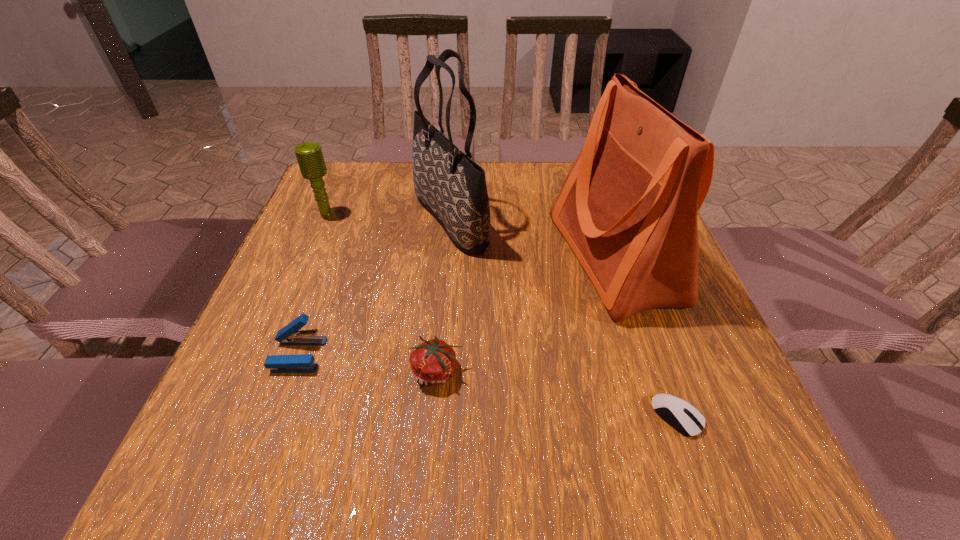
You are a GUI agent. You are given a task and a screenshot of the screen. Output one action in this format:
    pyautogui.click(x=<x>, y=<y>)
    Task: Click on the mouse present at the right edge
    
    Given the screenshot: What is the action you would take?
    pyautogui.click(x=685, y=418)

I want to click on object positioned at the far left corner, so click(309, 155).

The image size is (960, 540). What are the coordinates of `object that is at the far right corner` in the screenshot? It's located at (628, 207).

Where is `object that is at the near right corner`? object that is at the near right corner is located at coordinates (685, 418).

In the image, there is a desktop. At what (x,y) coordinates should I click in order to perform the action: click on vacant space at the far edge. Please return your answer as a coordinate pair (x, y). The height and width of the screenshot is (540, 960). Looking at the image, I should click on (547, 183).

The image size is (960, 540). I want to click on vacant space at the near edge, so pyautogui.click(x=571, y=457).

This screenshot has height=540, width=960. I want to click on free space at the left edge of the desktop, so click(x=252, y=345).

Find the location of a particular element. The height and width of the screenshot is (540, 960). vacant space at the right edge is located at coordinates (728, 395).

Identify the location of blank area at the far left corner. (329, 172).

The width and height of the screenshot is (960, 540). I want to click on vacant space at the near right corner of the desktop, so coord(727,453).